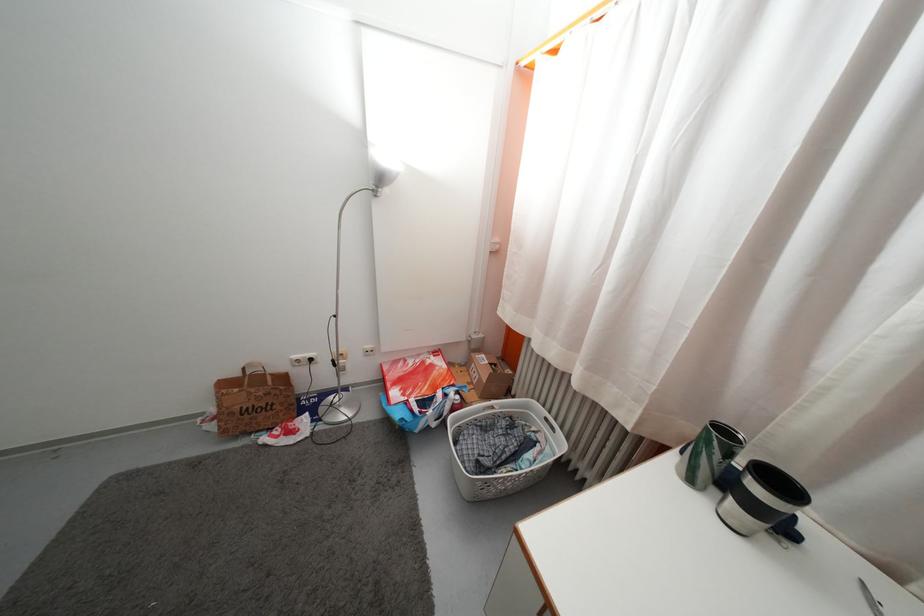
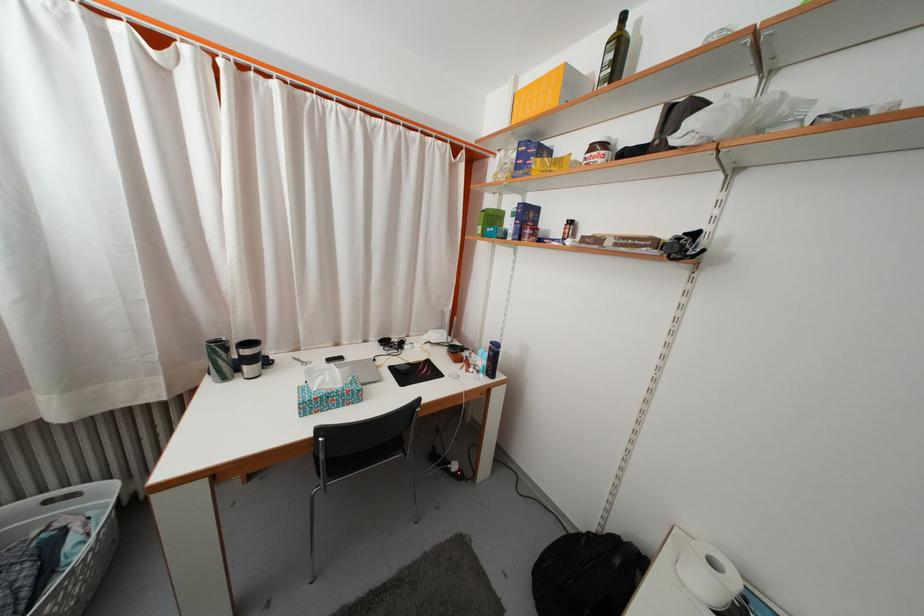
The point at (555, 419) is marked in the first image. Where is the corresponding point in the second image?

(49, 498)